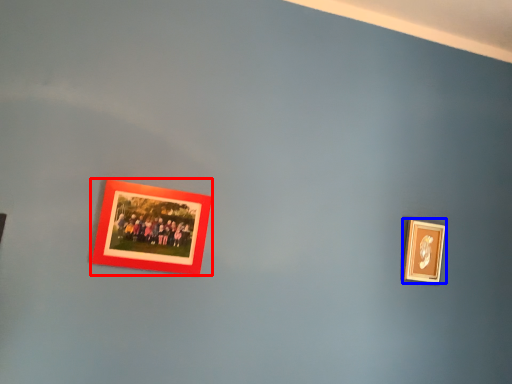
Question: Which of the following is the closest to the observer, picture frame (highlighted by a red box) or picture frame (highlighted by a blue box)?

Choices:
 (A) picture frame
 (B) picture frame

Answer: (A)